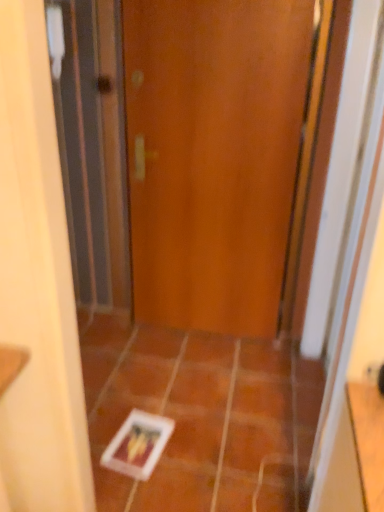
The image size is (384, 512). What do you see at coordinates (255, 447) in the screenshot? I see `orange matte tile at center, which ranks as the first ceramic tile in right-to-left order` at bounding box center [255, 447].

What do you see at coordinates (213, 156) in the screenshot? Image resolution: width=384 pixels, height=512 pixels. I see `wooden door at center` at bounding box center [213, 156].

The image size is (384, 512). Find the location of `orange matte tile at center, which ranks as the first ceramic tile in right-to-left order`. orange matte tile at center, which ranks as the first ceramic tile in right-to-left order is located at coordinates (255, 447).

From the image's perspective, is orange matte tile at center, which ranks as the first ceramic tile in right-to-left order, above or below wooden door at center?

Clearly, from the image's perspective, orange matte tile at center, which ranks as the first ceramic tile in right-to-left order, is below wooden door at center.

Is orange matte tile at center, the 2th ceramic tile positioned from the left, completely or partially outside of wooden door at center?

Indeed, orange matte tile at center, the 2th ceramic tile positioned from the left, is completely outside wooden door at center.

Would you consider orange matte tile at center, which ranks as the first ceramic tile in right-to-left order, to be distant from wooden door at center?

orange matte tile at center, which ranks as the first ceramic tile in right-to-left order, is far away from wooden door at center.

Looking at this image, considering the relative sizes of orange matte tile at center, which ranks as the first ceramic tile in right-to-left order, and wooden door at center in the image provided, is orange matte tile at center, which ranks as the first ceramic tile in right-to-left order, smaller than wooden door at center?

Yes.

Which of these two, white glossy tile at center, arranged as the 1th ceramic tile when viewed from the left, or orange matte tile at center, the 2th ceramic tile positioned from the left, stands shorter?

orange matte tile at center, the 2th ceramic tile positioned from the left.

Between white glossy tile at center, arranged as the 1th ceramic tile when viewed from the left, and orange matte tile at center, which ranks as the first ceramic tile in right-to-left order, which one appears on the left side from the viewer's perspective?

From the viewer's perspective, white glossy tile at center, arranged as the 1th ceramic tile when viewed from the left, appears more on the left side.

Does white glossy tile at center, which is the second ceramic tile in right-to-left order, turn towards orange matte tile at center, which ranks as the first ceramic tile in right-to-left order?

No, white glossy tile at center, which is the second ceramic tile in right-to-left order, is not turned towards orange matte tile at center, which ranks as the first ceramic tile in right-to-left order.

Considering the relative sizes of wooden door at center and orange matte tile at center, the 2th ceramic tile positioned from the left, in the image provided, is wooden door at center shorter than orange matte tile at center, the 2th ceramic tile positioned from the left,?

Incorrect, the height of wooden door at center does not fall short of that of orange matte tile at center, the 2th ceramic tile positioned from the left.

Is wooden door at center bigger than orange matte tile at center, the 2th ceramic tile positioned from the left?

Indeed, wooden door at center has a larger size compared to orange matte tile at center, the 2th ceramic tile positioned from the left.

Is wooden door at center not near orange matte tile at center, the 2th ceramic tile positioned from the left?

That's right, there is a large distance between wooden door at center and orange matte tile at center, the 2th ceramic tile positioned from the left.

Is wooden door at center positioned beyond the bounds of orange matte tile at center, which ranks as the first ceramic tile in right-to-left order?

Yes, wooden door at center is located beyond the bounds of orange matte tile at center, which ranks as the first ceramic tile in right-to-left order.

Is orange matte tile at center, the 2th ceramic tile positioned from the left, closer to the viewer compared to white glossy tile at center, arranged as the 1th ceramic tile when viewed from the left?

No, orange matte tile at center, the 2th ceramic tile positioned from the left, is further to the viewer.

Who is smaller, orange matte tile at center, the 2th ceramic tile positioned from the left, or white glossy tile at center, which is the second ceramic tile in right-to-left order?

With smaller size is orange matte tile at center, the 2th ceramic tile positioned from the left.

Is orange matte tile at center, which ranks as the first ceramic tile in right-to-left order, far from white glossy tile at center, which is the second ceramic tile in right-to-left order?

They are positioned close to each other.

Who is smaller, wooden door at center or white glossy tile at center, arranged as the 1th ceramic tile when viewed from the left?

Smaller between the two is white glossy tile at center, arranged as the 1th ceramic tile when viewed from the left.

Relative to white glossy tile at center, which is the second ceramic tile in right-to-left order, is wooden door at center in front or behind?

wooden door at center is positioned farther from the viewer than white glossy tile at center, which is the second ceramic tile in right-to-left order.

Which point is more distant from viewer, (184,121) or (146,505)?

The point (184,121) is more distant.

Is wooden door at center facing towards white glossy tile at center, which is the second ceramic tile in right-to-left order?

Yes.

Consider the image. Would you say white glossy tile at center, which is the second ceramic tile in right-to-left order, is outside wooden door at center?

Yes, white glossy tile at center, which is the second ceramic tile in right-to-left order, is located beyond the bounds of wooden door at center.

Which point is more forward, (174, 496) or (232, 3)?

The point (174, 496) is more forward.

How many degrees apart are the facing directions of white glossy tile at center, which is the second ceramic tile in right-to-left order, and wooden door at center?

They differ by 1.17 degrees in their facing directions.

From the image's perspective, which object appears higher, white glossy tile at center, arranged as the 1th ceramic tile when viewed from the left, or wooden door at center?

wooden door at center appears higher in the image.

Where is `door above the orange matte tile at center, which ranks as the first ceramic tile in right-to-left order (from a real-world perspective)`? The height and width of the screenshot is (512, 384). door above the orange matte tile at center, which ranks as the first ceramic tile in right-to-left order (from a real-world perspective) is located at coordinates (213, 156).

Locate an element on the screen. This screenshot has height=512, width=384. ceramic tile that appears below the orange matte tile at center, which ranks as the first ceramic tile in right-to-left order (from a real-world perspective) is located at coordinates (203, 417).

Which object lies nearer to the anchor point white glossy tile at center, which is the second ceramic tile in right-to-left order, wooden door at center or orange matte tile at center, which ranks as the first ceramic tile in right-to-left order?

orange matte tile at center, which ranks as the first ceramic tile in right-to-left order, is positioned closer to the anchor white glossy tile at center, which is the second ceramic tile in right-to-left order.

From the image, which object appears to be nearer to wooden door at center, white glossy tile at center, arranged as the 1th ceramic tile when viewed from the left, or orange matte tile at center, which ranks as the first ceramic tile in right-to-left order?

white glossy tile at center, arranged as the 1th ceramic tile when viewed from the left, lies closer to wooden door at center than the other object.

Estimate the real-world distances between objects in this image. Which object is closer to orange matte tile at center, which ranks as the first ceramic tile in right-to-left order, white glossy tile at center, arranged as the 1th ceramic tile when viewed from the left, or wooden door at center?

Based on the image, white glossy tile at center, arranged as the 1th ceramic tile when viewed from the left, appears to be nearer to orange matte tile at center, which ranks as the first ceramic tile in right-to-left order.

Based on their spatial positions, is orange matte tile at center, the 2th ceramic tile positioned from the left, or white glossy tile at center, arranged as the 1th ceramic tile when viewed from the left, further from wooden door at center?

Among the two, orange matte tile at center, the 2th ceramic tile positioned from the left, is located further to wooden door at center.

Estimate the real-world distances between objects in this image. Which object is further from orange matte tile at center, which ranks as the first ceramic tile in right-to-left order, wooden door at center or white glossy tile at center, which is the second ceramic tile in right-to-left order?

wooden door at center.

Which object lies nearer to the anchor point white glossy tile at center, arranged as the 1th ceramic tile when viewed from the left, orange matte tile at center, the 2th ceramic tile positioned from the left, or wooden door at center?

orange matte tile at center, the 2th ceramic tile positioned from the left, lies closer to white glossy tile at center, arranged as the 1th ceramic tile when viewed from the left, than the other object.

Identify the location of ceramic tile between wooden door at center and orange matte tile at center, the 2th ceramic tile positioned from the left, from top to bottom. Image resolution: width=384 pixels, height=512 pixels. (203, 417).